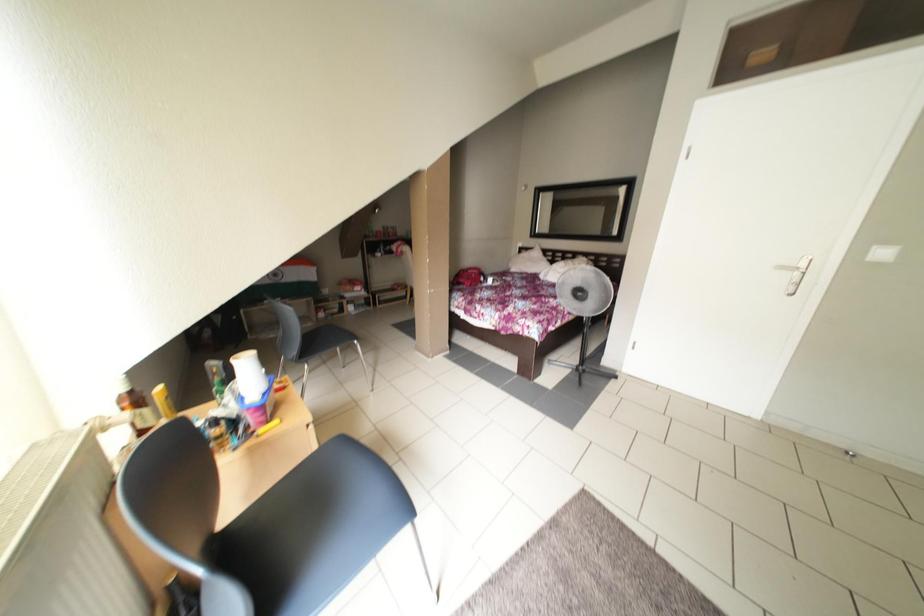
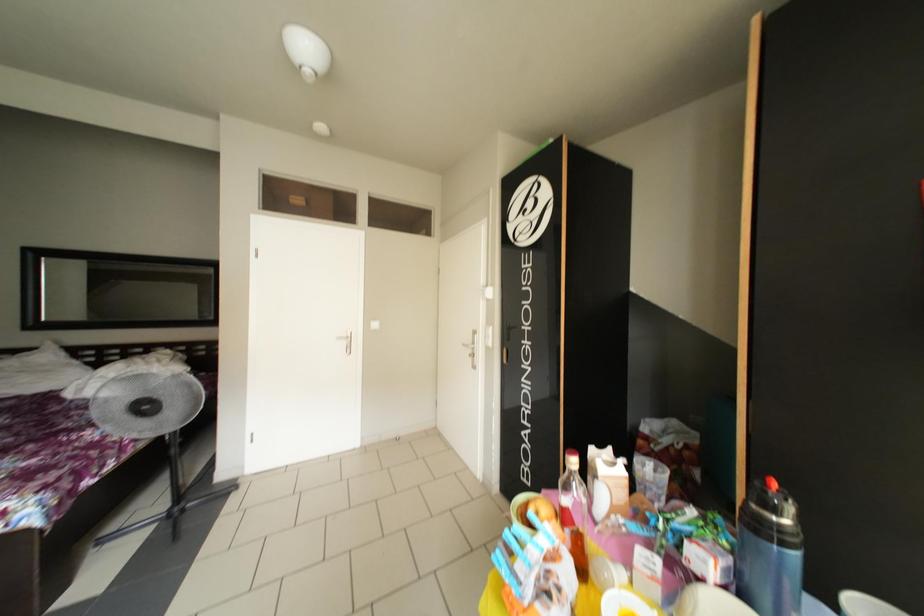
Question: Based on the continuous images, in which direction is the camera rotating? Reply with the corresponding letter.

Choices:
 (A) Left
 (B) Right
 (C) Up
 (D) Down

Answer: (B)